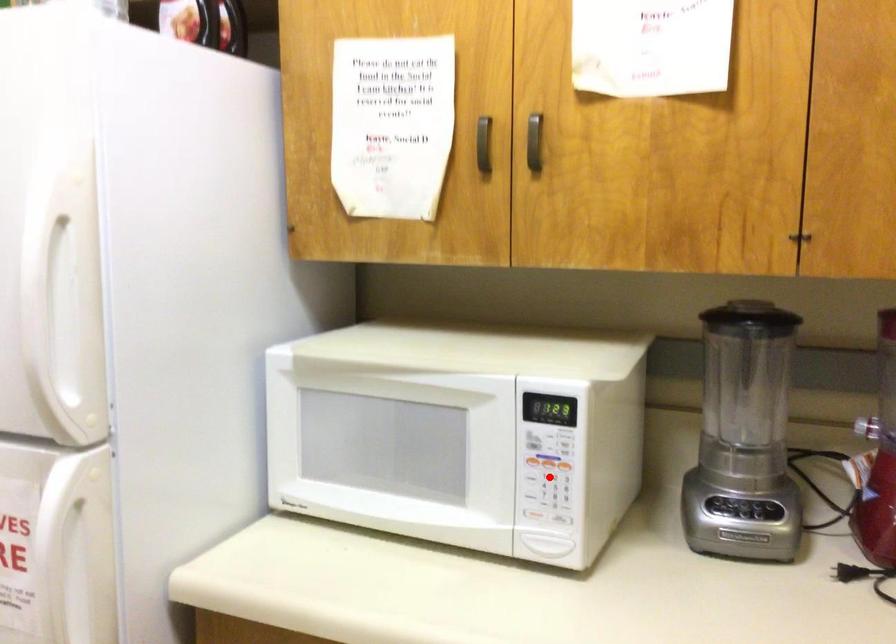
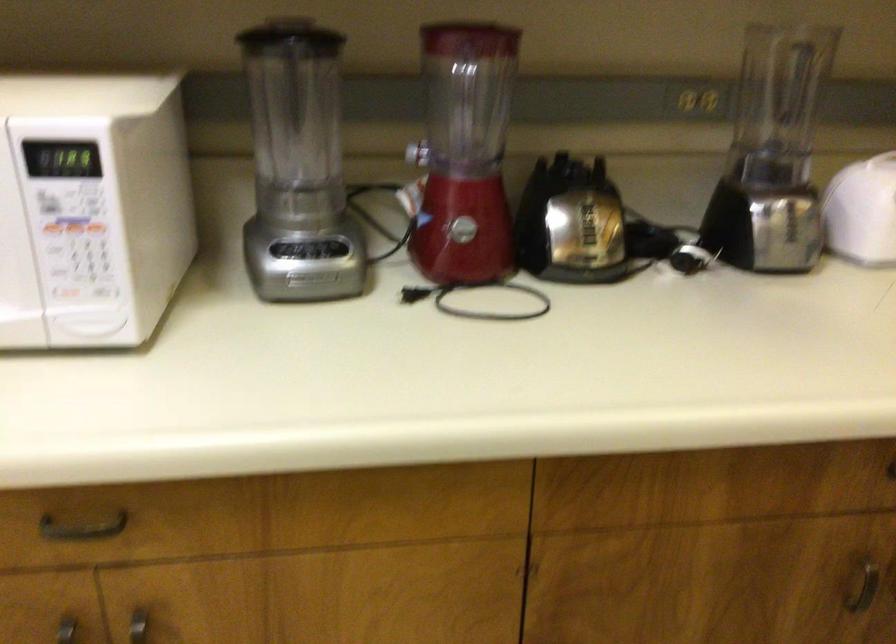
In the second image, find the point that corresponds to the highlighted location in the first image.

(74, 242)